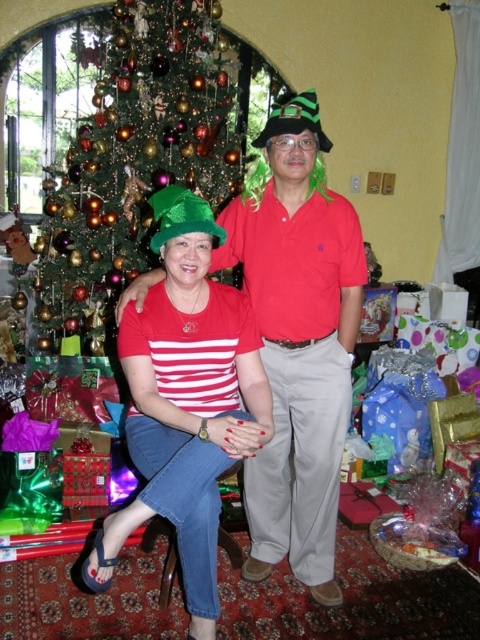
You are a photographer taking a picture of the festive scene. You notice the matte red shirt at center and the shiny green christmas tree at left. Which object is closer to the camera?

The matte red shirt at center is shorter than the shiny green christmas tree at left, so it is closer to the camera.

You are standing in the festive Christmas scene and want to place a small gift under the Christmas tree. The gift must be placed exactly at the location marked by the point labeled as point (186,401). Which object in the scene is located at that point?

The point (186,401) corresponds to the matte green hat at center.

You are a delivery robot that is 2 feet wide. You need to deliver a package from the shiny green christmas tree at left to the matte red shirt at center. Can you navigate the space between them?

The distance between the matte red shirt at center and the shiny green christmas tree at left is 4.09 feet. Since the robot is 2 feet wide, it can easily navigate the space between them as the distance is sufficient for movement.